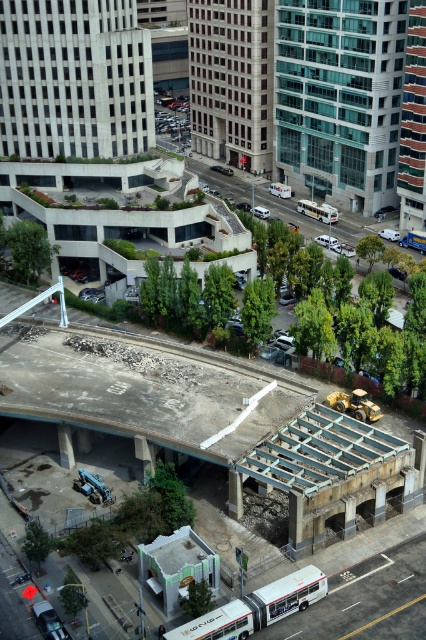
You are a pedestrian standing at the edge of the construction site and want to cross the street to reach the multi level parking structure. You see a white matte bus at center and a matte silver sedan at center. Which vehicle should you avoid to safely navigate towards the parking structure?

You should avoid the white matte bus at center because it is to the right of the matte silver sedan at center, so the matte silver sedan at center is closer to your path towards the parking structure.

You are standing at the point with coordinates point at (256, 608) in the image. What object are you facing?

The point at (256, 608) corresponds to the white matte bus at lower center, so you are facing the white matte bus at lower center.

You are standing at the point with coordinates 0.5, 0.5 in the image. Which direction should you move to reach the blue metallic bus at center?

To reach the blue metallic bus at center from the coordinates (213,320), you should move southwest because the bus is located at point (414,241), which is southwest of your current position.